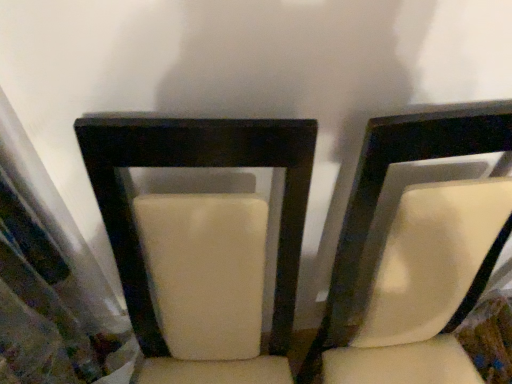
Question: Which direction should I rotate to face suede-like white chair at center, which appears as the 1th chair when viewed from the right, — up or down?

Choices:
 (A) down
 (B) up

Answer: (A)

Question: Can you confirm if suede-like beige chair at center, marked as the second chair in a right-to-left arrangement, is shorter than suede-like white chair at center, which is counted as the 2th chair, starting from the left?

Choices:
 (A) no
 (B) yes

Answer: (B)

Question: Considering the relative sizes of suede-like beige chair at center, marked as the second chair in a right-to-left arrangement, and suede-like white chair at center, which appears as the 1th chair when viewed from the right, in the image provided, is suede-like beige chair at center, marked as the second chair in a right-to-left arrangement, thinner than suede-like white chair at center, which appears as the 1th chair when viewed from the right,?

Choices:
 (A) yes
 (B) no

Answer: (B)

Question: Are suede-like beige chair at center, acting as the first chair starting from the left, and suede-like white chair at center, which is counted as the 2th chair, starting from the left, located far from each other?

Choices:
 (A) no
 (B) yes

Answer: (A)

Question: Is suede-like beige chair at center, marked as the second chair in a right-to-left arrangement, at the left side of suede-like white chair at center, which is counted as the 2th chair, starting from the left?

Choices:
 (A) yes
 (B) no

Answer: (A)

Question: Is suede-like beige chair at center, acting as the first chair starting from the left, oriented towards suede-like white chair at center, which is counted as the 2th chair, starting from the left?

Choices:
 (A) no
 (B) yes

Answer: (A)

Question: Is suede-like white chair at center, which appears as the 1th chair when viewed from the right, surrounded by suede-like beige chair at center, marked as the second chair in a right-to-left arrangement?

Choices:
 (A) yes
 (B) no

Answer: (B)

Question: Considering the relative positions of suede-like white chair at center, which appears as the 1th chair when viewed from the right, and suede-like beige chair at center, acting as the first chair starting from the left, in the image provided, is suede-like white chair at center, which appears as the 1th chair when viewed from the right, behind suede-like beige chair at center, acting as the first chair starting from the left,?

Choices:
 (A) yes
 (B) no

Answer: (A)

Question: Could suede-like beige chair at center, marked as the second chair in a right-to-left arrangement, be considered to be inside suede-like white chair at center, which is counted as the 2th chair, starting from the left?

Choices:
 (A) yes
 (B) no

Answer: (B)

Question: Can you confirm if suede-like white chair at center, which appears as the 1th chair when viewed from the right, is thinner than suede-like beige chair at center, marked as the second chair in a right-to-left arrangement?

Choices:
 (A) no
 (B) yes

Answer: (B)

Question: Is suede-like white chair at center, which appears as the 1th chair when viewed from the right, positioned in front of suede-like beige chair at center, acting as the first chair starting from the left?

Choices:
 (A) no
 (B) yes

Answer: (A)

Question: Are suede-like white chair at center, which appears as the 1th chair when viewed from the right, and suede-like beige chair at center, acting as the first chair starting from the left, located far from each other?

Choices:
 (A) yes
 (B) no

Answer: (B)

Question: Considering the relative sizes of suede-like white chair at center, which appears as the 1th chair when viewed from the right, and suede-like beige chair at center, marked as the second chair in a right-to-left arrangement, in the image provided, is suede-like white chair at center, which appears as the 1th chair when viewed from the right, taller than suede-like beige chair at center, marked as the second chair in a right-to-left arrangement,?

Choices:
 (A) no
 (B) yes

Answer: (B)

Question: Considering the positions of suede-like beige chair at center, marked as the second chair in a right-to-left arrangement, and suede-like white chair at center, which is counted as the 2th chair, starting from the left, in the image, is suede-like beige chair at center, marked as the second chair in a right-to-left arrangement, wider or thinner than suede-like white chair at center, which is counted as the 2th chair, starting from the left,?

Choices:
 (A) thin
 (B) wide

Answer: (B)